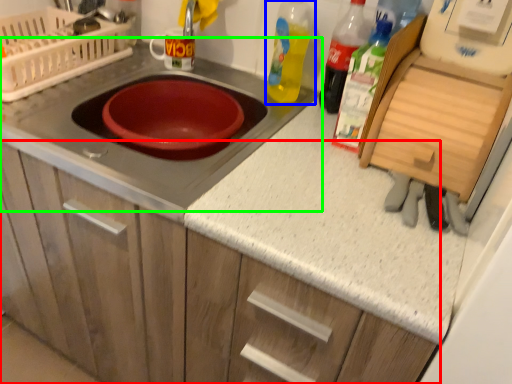
Question: Which is farther away from cabinetry (highlighted by a red box)? bottle (highlighted by a blue box) or gas stove (highlighted by a green box)?

Choices:
 (A) bottle
 (B) gas stove

Answer: (A)